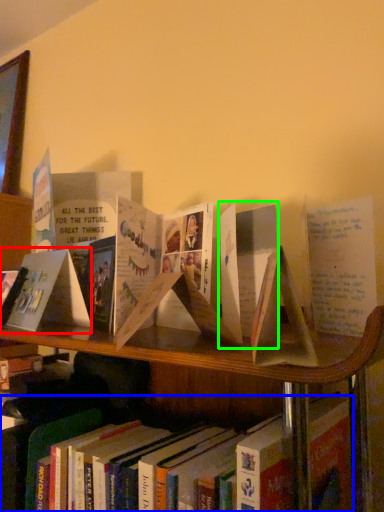
Question: Based on their relative distances, which object is nearer to paperback book (highlighted by a red box)? Choose from book (highlighted by a blue box) and paperback book (highlighted by a green box).

Choices:
 (A) book
 (B) paperback book

Answer: (A)